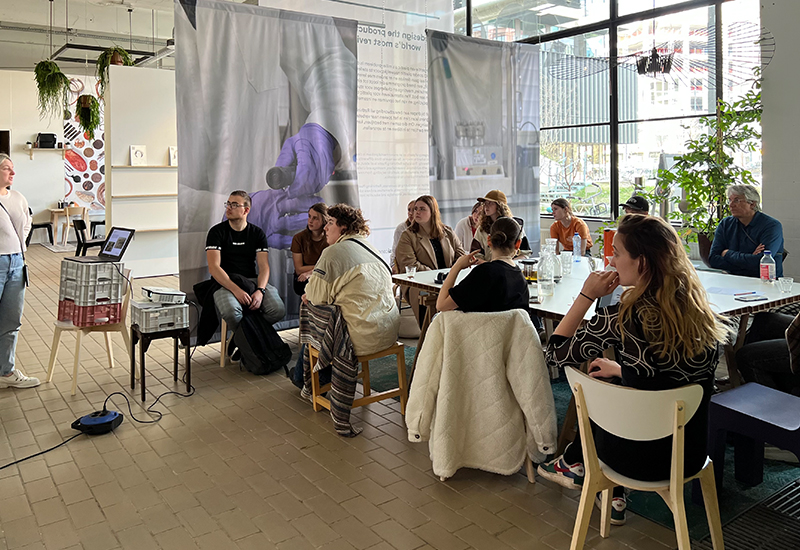
What are the coordinates of `chair` in the screenshot? It's located at (622, 423), (758, 410), (394, 351), (222, 330), (116, 326).